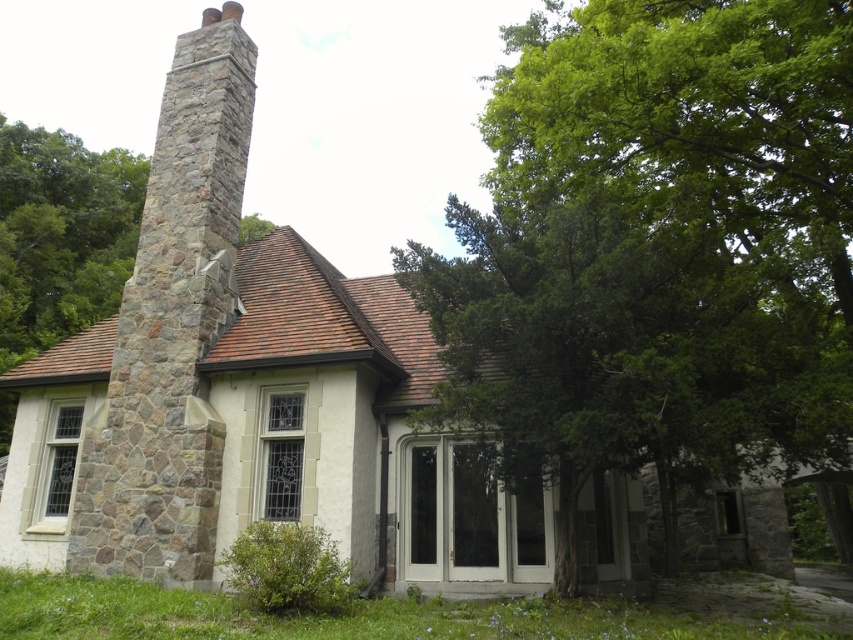
Can you confirm if green leafy tree at center is shorter than stone chimney at left?

No, green leafy tree at center is not shorter than stone chimney at left.

Which of these two, green leafy tree at center or stone chimney at left, stands taller?

green leafy tree at center

Describe the element at coordinates (654, 250) in the screenshot. I see `green leafy tree at center` at that location.

This screenshot has height=640, width=853. I want to click on green leafy tree at center, so click(x=654, y=250).